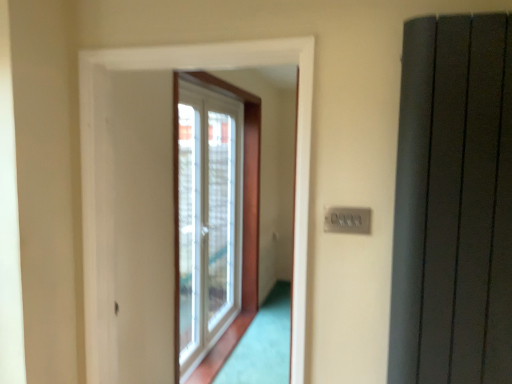
Question: Does matte gray radiator at right have a lesser width compared to gray plastic switch at upper right?

Choices:
 (A) yes
 (B) no

Answer: (B)

Question: Is matte gray radiator at right to the right of gray plastic switch at upper right from the viewer's perspective?

Choices:
 (A) yes
 (B) no

Answer: (A)

Question: From the image's perspective, is matte gray radiator at right over gray plastic switch at upper right?

Choices:
 (A) yes
 (B) no

Answer: (A)

Question: Considering the relative sizes of matte gray radiator at right and gray plastic switch at upper right in the image provided, is matte gray radiator at right bigger than gray plastic switch at upper right?

Choices:
 (A) yes
 (B) no

Answer: (A)

Question: Does matte gray radiator at right contain gray plastic switch at upper right?

Choices:
 (A) yes
 (B) no

Answer: (B)

Question: From a real-world perspective, is matte gray radiator at right above or below gray plastic switch at upper right?

Choices:
 (A) above
 (B) below

Answer: (A)

Question: Is matte gray radiator at right inside or outside of gray plastic switch at upper right?

Choices:
 (A) outside
 (B) inside

Answer: (A)

Question: Would you say matte gray radiator at right is to the left or to the right of gray plastic switch at upper right in the picture?

Choices:
 (A) right
 (B) left

Answer: (A)

Question: Considering their positions, is matte gray radiator at right located in front of or behind gray plastic switch at upper right?

Choices:
 (A) behind
 (B) front

Answer: (B)

Question: From the image's perspective, is white plastic window at center positioned above or below matte gray radiator at right?

Choices:
 (A) below
 (B) above

Answer: (A)

Question: Considering the positions of white plastic window at center and matte gray radiator at right in the image, is white plastic window at center wider or thinner than matte gray radiator at right?

Choices:
 (A) wide
 (B) thin

Answer: (A)

Question: From a real-world perspective, is white plastic window at center physically located above or below matte gray radiator at right?

Choices:
 (A) above
 (B) below

Answer: (B)

Question: Considering the positions of white plastic window at center and matte gray radiator at right in the image, is white plastic window at center taller or shorter than matte gray radiator at right?

Choices:
 (A) tall
 (B) short

Answer: (A)

Question: Is white plastic window at center in front of or behind gray plastic switch at upper right in the image?

Choices:
 (A) front
 (B) behind

Answer: (B)

Question: Looking at their shapes, would you say white plastic window at center is wider or thinner than gray plastic switch at upper right?

Choices:
 (A) wide
 (B) thin

Answer: (A)